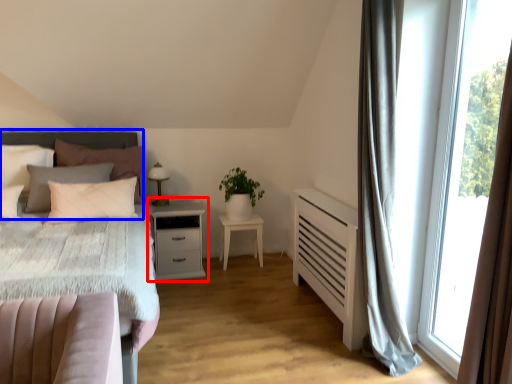
Question: Which point is further to the camera, nightstand (highlighted by a red box) or headboard (highlighted by a blue box)?

Choices:
 (A) nightstand
 (B) headboard

Answer: (A)